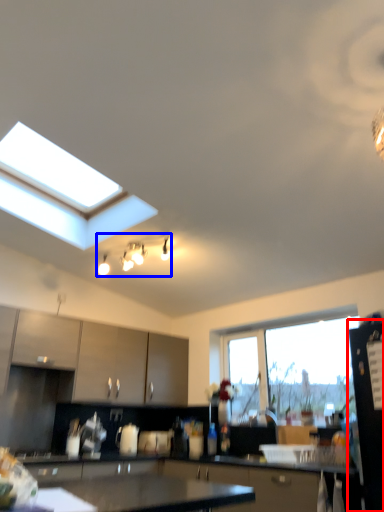
Question: Which point is closer to the camera, appliance (highlighted by a red box) or light fixture (highlighted by a blue box)?

Choices:
 (A) appliance
 (B) light fixture

Answer: (A)